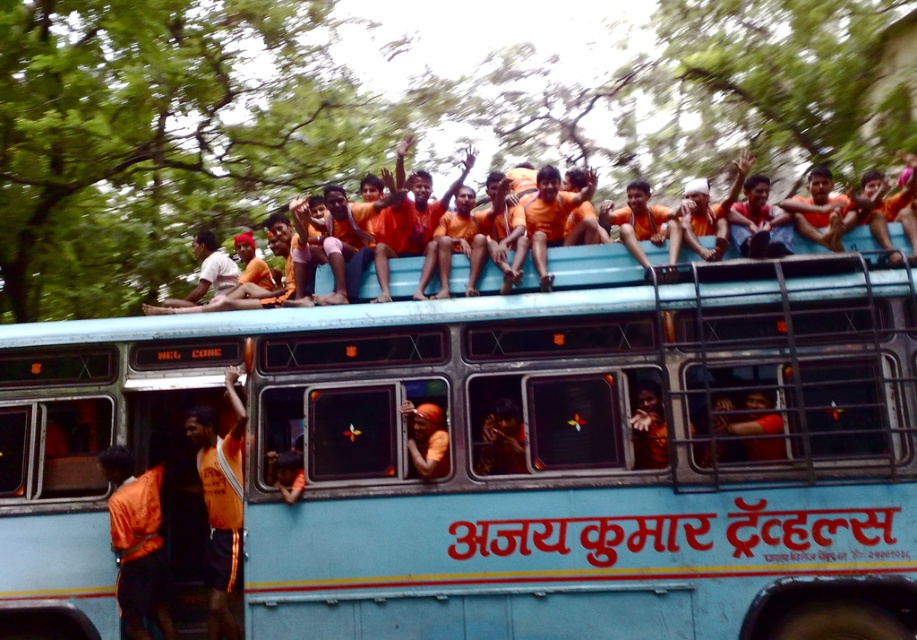
You are a photographer trying to capture the orange fabric shirt at upper center and the orange shirt at center on the bus roof. Which of the two shirts has a wider width?

The orange fabric shirt at upper center has a wider width than the orange shirt at center.

You are a passenger on the moving bus and want to wave to someone standing at the bus stop. You see the point marked as point (x=203, y=275) on the upper left. Is the matte orange shirt at upper left located at that point?

Yes, the matte orange shirt at upper left is located at point (x=203, y=275).

You are a passenger on the bus and you see a point at coordinates (589, 252). What object is this point located on?

The point at coordinates (589, 252) is located on the orange fabric shirt at upper center.